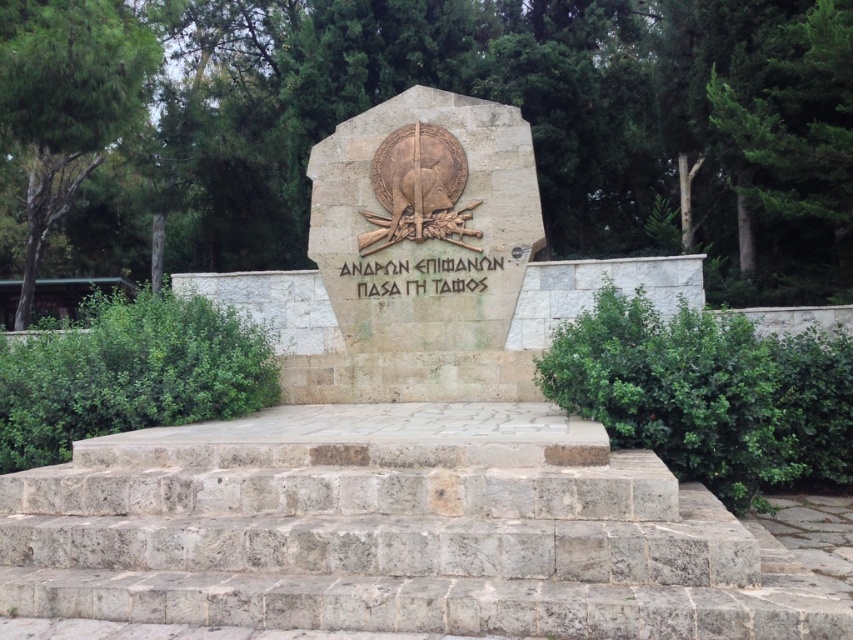
You are standing in front of the monument and want to place a small flag at the highest point of the gray stone stairs at center and the stone textured monument at center. Which location would require you to climb higher to reach?

The stone textured monument at center requires climbing higher because it is taller than the gray stone stairs at center.

You are a tour guide explaining the layout of the monument to visitors. You mention the gray stone stairs at center and the stone textured monument at center. Which one has a greater width?

The gray stone stairs at center has a greater width than the stone textured monument at center according to the description.